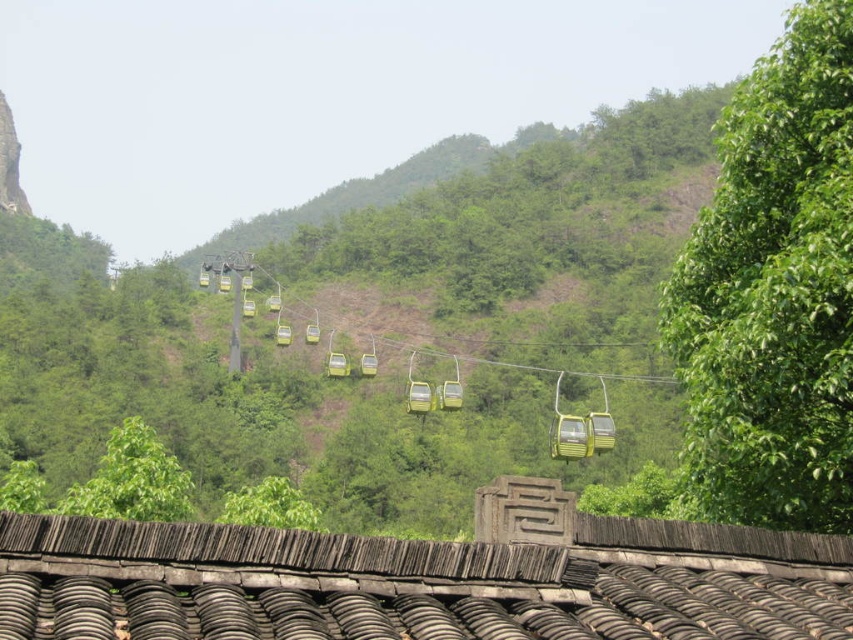
You are standing at the point marked as point [132,480] in the image. What object is directly in front of you?

The green leafy tree at lower left is located at point [132,480], so the object directly in front of you is the green leafy tree at lower left.

Consider the image. You are a bird flying over the scenic view. You see the green leafy tree at right and the green leafy tree at center. Which tree is positioned higher in the image?

The green leafy tree at right is positioned higher in the image than the green leafy tree at center.

You are a hiker trying to decide which path to take. You see a green leafy tree at right and a green leafy tree at center. Which tree is taller?

The green leafy tree at center is taller than the green leafy tree at right.